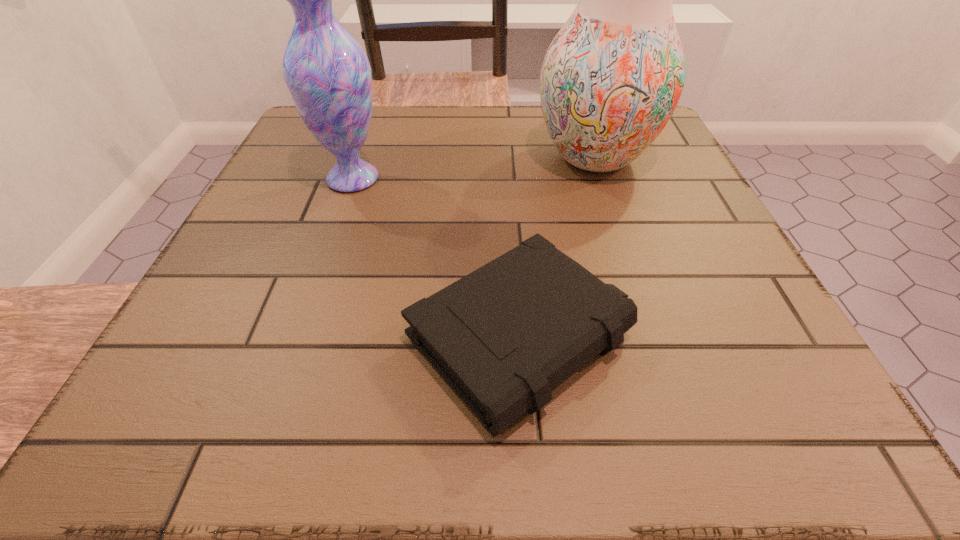
Where is `unoccupied position between the right vase and the Bible`? unoccupied position between the right vase and the Bible is located at coordinates tap(558, 247).

This screenshot has height=540, width=960. What are the coordinates of `empty space that is in between the left vase and the shortest object` in the screenshot? It's located at (437, 258).

Where is `blank region between the right vase and the leftmost object`? The width and height of the screenshot is (960, 540). blank region between the right vase and the leftmost object is located at coordinates (473, 168).

Find the location of a particular element. This screenshot has height=540, width=960. empty location between the nearest object and the right vase is located at coordinates (558, 247).

Identify the location of empty space that is in between the leftmost object and the right vase. The image size is (960, 540). (473, 168).

In order to click on vacant area that lies between the leftmost object and the Bible in this screenshot , I will do `click(437, 258)`.

Where is `unoccupied position between the nearest object and the right vase`? The height and width of the screenshot is (540, 960). unoccupied position between the nearest object and the right vase is located at coordinates (558, 247).

Select which object is the second closest to the shortest object. Please provide its 2D coordinates. Your answer should be formatted as a tuple, i.e. [(x, y)], where the tuple contains the x and y coordinates of a point satisfying the conditions above.

[(611, 79)]

You are a GUI agent. You are given a task and a screenshot of the screen. Output one action in this format:
    pyautogui.click(x=<x>, y=<y>)
    Task: Click on the object that can be found as the second closest to the right vase
    This screenshot has width=960, height=540.
    Given the screenshot: What is the action you would take?
    pyautogui.click(x=328, y=75)

Locate an element on the screen. vacant area in the image that satisfies the following two spatial constraints: 1. on the front side of the Bible; 2. on the left side of the leftmost object is located at coordinates (297, 337).